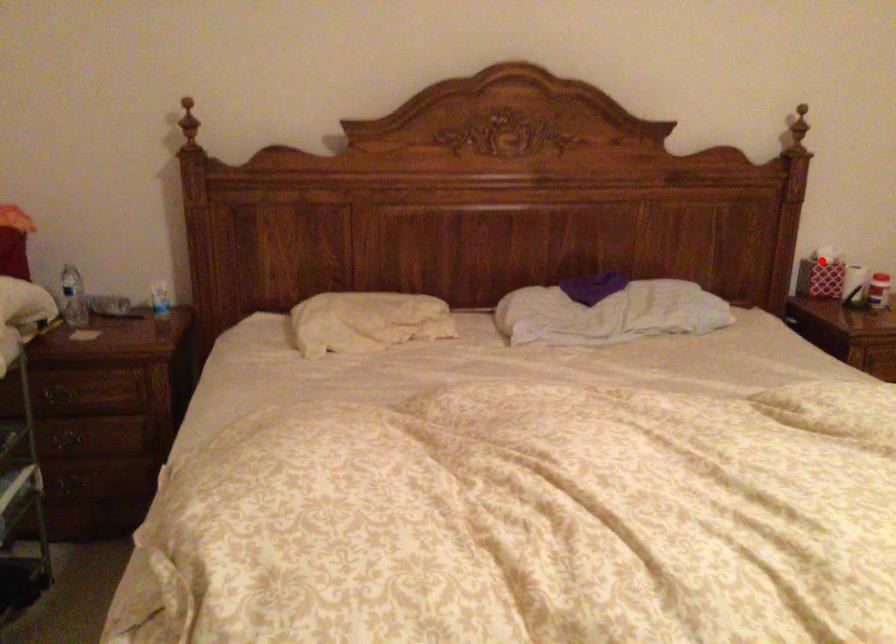
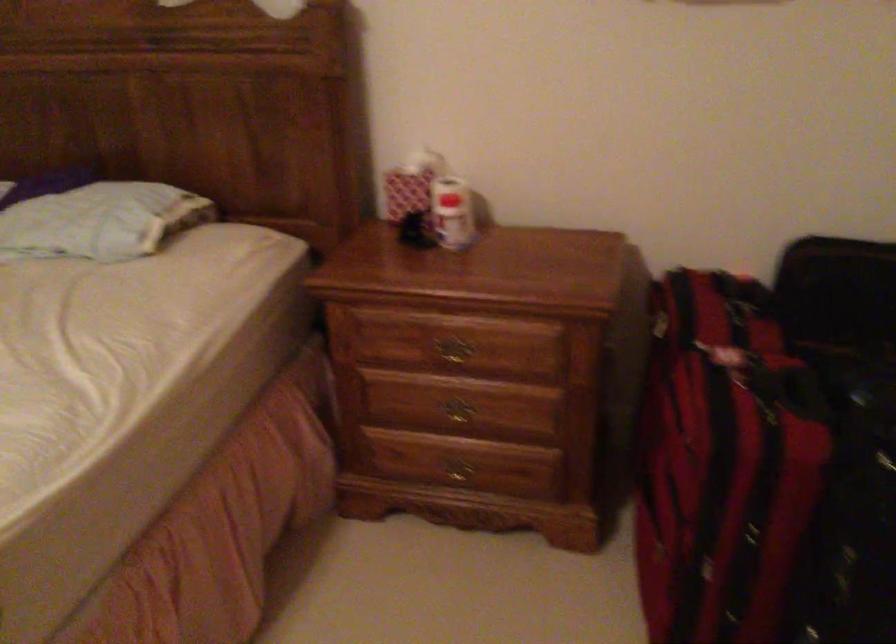
The point at the highlighted location is marked in the first image. Where is the corresponding point in the second image?

(410, 184)